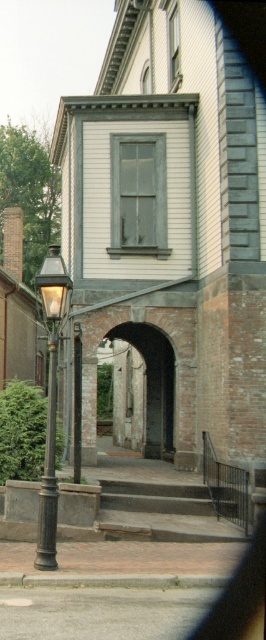
Is point (123, 154) in front of point (60, 296)?

No, it is not.

Identify the location of teal glass window at center. The image size is (266, 640). (138, 195).

Who is taller, polished brass streetlamp at left or clear glass window at upper center?

polished brass streetlamp at left is taller.

Between point (48, 372) and point (173, 83), which one is positioned behind?

Positioned behind is point (173, 83).

This screenshot has width=266, height=640. What do you see at coordinates (51, 403) in the screenshot?
I see `polished brass streetlamp at left` at bounding box center [51, 403].

Locate an element on the screen. polished brass streetlamp at left is located at coordinates (51, 403).

From the picture: Who is shorter, teal glass window at center or clear glass window at upper center?

clear glass window at upper center

Between teal glass window at center and clear glass window at upper center, which one is positioned lower?

teal glass window at center is below.

Is point (159, 138) positioned before point (169, 72)?

Yes, it is in front of point (169, 72).

You are a GUI agent. You are given a task and a screenshot of the screen. Output one action in this format:
    pyautogui.click(x=<x>, y=<y>)
    Task: Click on the teal glass window at center
    The width and height of the screenshot is (266, 640).
    Given the screenshot: What is the action you would take?
    pyautogui.click(x=138, y=195)